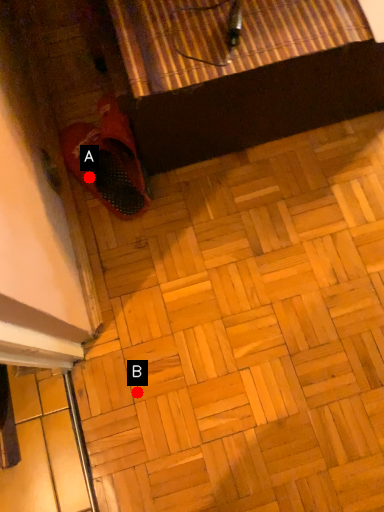
Question: Two points are circled on the image, labeled by A and B beside each circle. Which of the following is the farthest from the observer?

Choices:
 (A) A is further
 (B) B is further

Answer: (A)